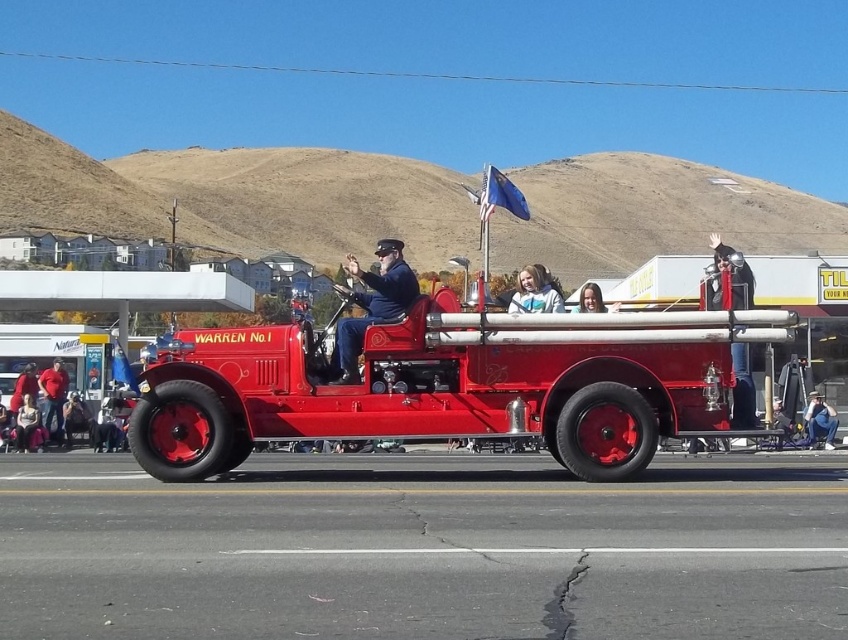
Locate an element on the screen. The width and height of the screenshot is (848, 640). shiny red fire truck at center is located at coordinates (445, 385).

Measure the distance between point (573, 406) and camera.

Point (573, 406) is 12.06 meters away from camera.

Where is `shiny red fire truck at center`? The image size is (848, 640). shiny red fire truck at center is located at coordinates (445, 385).

In the scene shown: Who is higher up, denim pants at lower right or smooth skin face at center?

Positioned higher is smooth skin face at center.

Between point (823, 420) and point (579, 292), which one is positioned in front?

Positioned in front is point (579, 292).

At what (x,y) coordinates should I click in order to perform the action: click on denim pants at lower right. Please return your answer as a coordinate pair (x, y). The height and width of the screenshot is (640, 848). Looking at the image, I should click on (819, 420).

Does shiny red fire truck at center appear on the left side of matte black uniform at center?

Indeed, shiny red fire truck at center is positioned on the left side of matte black uniform at center.

Can you confirm if shiny red fire truck at center is shorter than matte black uniform at center?

Yes.

I want to click on shiny red fire truck at center, so click(445, 385).